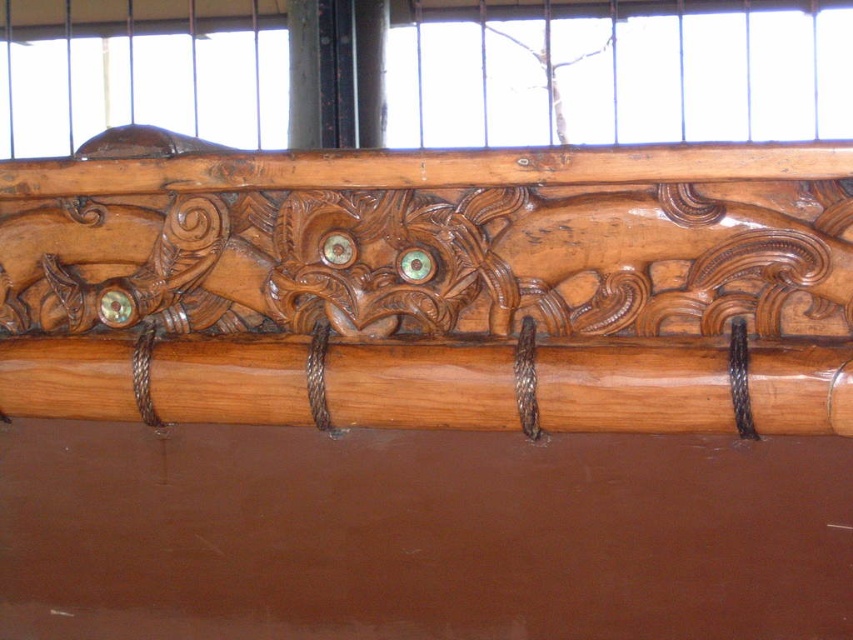
Is shiny brown wood carving at center taller than shiny brown wood at center?

Yes, shiny brown wood carving at center is taller than shiny brown wood at center.

Does shiny brown wood carving at center have a greater width compared to shiny brown wood at center?

Yes.

Is point (523, 180) positioned in front of point (469, 365)?

Yes, it is.

What are the coordinates of `shiny brown wood carving at center` in the screenshot? It's located at (430, 285).